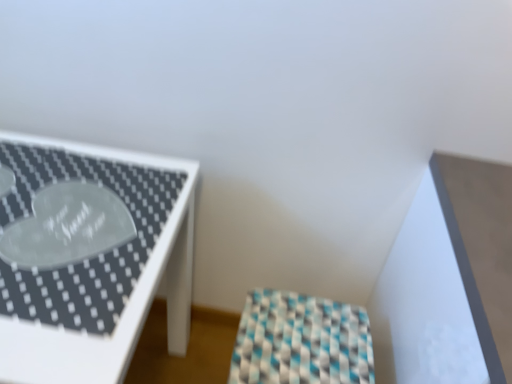
In order to click on checkered fabric stool at center, which appears as the second furniture when viewed from the left in this screenshot , I will do `click(301, 341)`.

What do you see at coordinates (301, 341) in the screenshot? The image size is (512, 384). I see `checkered fabric stool at center, which appears as the second furniture when viewed from the left` at bounding box center [301, 341].

How much space does white glossy table at left, positioned as the 1th furniture in left-to-right order, occupy vertically?

The height of white glossy table at left, positioned as the 1th furniture in left-to-right order, is 30.68 inches.

Describe the element at coordinates (95, 265) in the screenshot. I see `white glossy table at left, which appears as the 2th furniture when viewed from the right` at that location.

The height and width of the screenshot is (384, 512). Find the location of `white glossy table at left, which appears as the 2th furniture when viewed from the right`. white glossy table at left, which appears as the 2th furniture when viewed from the right is located at coordinates (95, 265).

The height and width of the screenshot is (384, 512). Find the location of `checkered fabric stool at center, which appears as the second furniture when viewed from the left`. checkered fabric stool at center, which appears as the second furniture when viewed from the left is located at coordinates (301, 341).

Which object is positioned more to the left, white glossy table at left, which appears as the 2th furniture when viewed from the right, or checkered fabric stool at center, which appears as the second furniture when viewed from the left?

white glossy table at left, which appears as the 2th furniture when viewed from the right.

Looking at this image, which object is further away from the camera taking this photo, white glossy table at left, which appears as the 2th furniture when viewed from the right, or checkered fabric stool at center, which is the 1th furniture in right-to-left order?

checkered fabric stool at center, which is the 1th furniture in right-to-left order, is more distant.

Which is farther, [16,194] or [311,358]?

The point [311,358] is behind.

From the image's perspective, which is above, white glossy table at left, positioned as the 1th furniture in left-to-right order, or checkered fabric stool at center, which appears as the second furniture when viewed from the left?

white glossy table at left, positioned as the 1th furniture in left-to-right order, appears higher in the image.

From a real-world perspective, is white glossy table at left, which appears as the 2th furniture when viewed from the right, over checkered fabric stool at center, which appears as the second furniture when viewed from the left?

Yes, from a real-world perspective, white glossy table at left, which appears as the 2th furniture when viewed from the right, is over checkered fabric stool at center, which appears as the second furniture when viewed from the left

In the scene shown: Considering the relative sizes of white glossy table at left, which appears as the 2th furniture when viewed from the right, and checkered fabric stool at center, which appears as the second furniture when viewed from the left, in the image provided, is white glossy table at left, which appears as the 2th furniture when viewed from the right, thinner than checkered fabric stool at center, which appears as the second furniture when viewed from the left,?

No.

Does white glossy table at left, positioned as the 1th furniture in left-to-right order, have a greater height compared to checkered fabric stool at center, which appears as the second furniture when viewed from the left?

Yes.

Looking at the image, does white glossy table at left, which appears as the 2th furniture when viewed from the right, seem bigger or smaller compared to checkered fabric stool at center, which appears as the second furniture when viewed from the left?

In the image, white glossy table at left, which appears as the 2th furniture when viewed from the right, appears to be larger than checkered fabric stool at center, which appears as the second furniture when viewed from the left.

Is white glossy table at left, which appears as the 2th furniture when viewed from the right, inside the boundaries of checkered fabric stool at center, which appears as the second furniture when viewed from the left, or outside?

white glossy table at left, which appears as the 2th furniture when viewed from the right, exists outside the volume of checkered fabric stool at center, which appears as the second furniture when viewed from the left.

Are white glossy table at left, which appears as the 2th furniture when viewed from the right, and checkered fabric stool at center, which appears as the second furniture when viewed from the left, located far from each other?

white glossy table at left, which appears as the 2th furniture when viewed from the right, is near checkered fabric stool at center, which appears as the second furniture when viewed from the left, not far away.

Is white glossy table at left, positioned as the 1th furniture in left-to-right order, facing towards checkered fabric stool at center, which is the 1th furniture in right-to-left order?

No, white glossy table at left, positioned as the 1th furniture in left-to-right order, is not aimed at checkered fabric stool at center, which is the 1th furniture in right-to-left order.

At what (x,y) coordinates should I click in order to perform the action: click on furniture above the checkered fabric stool at center, which appears as the second furniture when viewed from the left (from the image's perspective). Please return your answer as a coordinate pair (x, y). The image size is (512, 384). Looking at the image, I should click on (95, 265).

Which object is positioned more to the left, checkered fabric stool at center, which is the 1th furniture in right-to-left order, or white glossy table at left, positioned as the 1th furniture in left-to-right order?

white glossy table at left, positioned as the 1th furniture in left-to-right order.

Between checkered fabric stool at center, which is the 1th furniture in right-to-left order, and white glossy table at left, which appears as the 2th furniture when viewed from the right, which one is positioned in front?

white glossy table at left, which appears as the 2th furniture when viewed from the right.

Which is less distant, (367, 359) or (7, 305)?

Clearly, point (367, 359) is more distant from the camera than point (7, 305).

From the image's perspective, is checkered fabric stool at center, which is the 1th furniture in right-to-left order, on top of white glossy table at left, positioned as the 1th furniture in left-to-right order?

Actually, checkered fabric stool at center, which is the 1th furniture in right-to-left order, appears below white glossy table at left, positioned as the 1th furniture in left-to-right order, in the image.

From a real-world perspective, is checkered fabric stool at center, which is the 1th furniture in right-to-left order, positioned above or below white glossy table at left, which appears as the 2th furniture when viewed from the right?

checkered fabric stool at center, which is the 1th furniture in right-to-left order, is below white glossy table at left, which appears as the 2th furniture when viewed from the right.

Considering the sizes of checkered fabric stool at center, which appears as the second furniture when viewed from the left, and white glossy table at left, which appears as the 2th furniture when viewed from the right, in the image, is checkered fabric stool at center, which appears as the second furniture when viewed from the left, wider or thinner than white glossy table at left, which appears as the 2th furniture when viewed from the right,?

Clearly, checkered fabric stool at center, which appears as the second furniture when viewed from the left, has less width compared to white glossy table at left, which appears as the 2th furniture when viewed from the right.

From their relative heights in the image, would you say checkered fabric stool at center, which is the 1th furniture in right-to-left order, is taller or shorter than white glossy table at left, positioned as the 1th furniture in left-to-right order?

In the image, checkered fabric stool at center, which is the 1th furniture in right-to-left order, appears to be shorter than white glossy table at left, positioned as the 1th furniture in left-to-right order.

Does checkered fabric stool at center, which appears as the second furniture when viewed from the left, have a larger size compared to white glossy table at left, positioned as the 1th furniture in left-to-right order?

Incorrect, checkered fabric stool at center, which appears as the second furniture when viewed from the left, is not larger than white glossy table at left, positioned as the 1th furniture in left-to-right order.

Is checkered fabric stool at center, which is the 1th furniture in right-to-left order, inside the boundaries of white glossy table at left, which appears as the 2th furniture when viewed from the right, or outside?

checkered fabric stool at center, which is the 1th furniture in right-to-left order, is spatially situated outside white glossy table at left, which appears as the 2th furniture when viewed from the right.

Is checkered fabric stool at center, which appears as the second furniture when viewed from the left, directly adjacent to white glossy table at left, which appears as the 2th furniture when viewed from the right?

No, checkered fabric stool at center, which appears as the second furniture when viewed from the left, is not making contact with white glossy table at left, which appears as the 2th furniture when viewed from the right.

Is checkered fabric stool at center, which is the 1th furniture in right-to-left order, oriented towards white glossy table at left, which appears as the 2th furniture when viewed from the right?

Yes, checkered fabric stool at center, which is the 1th furniture in right-to-left order, is facing white glossy table at left, which appears as the 2th furniture when viewed from the right.

Can you tell me how much checkered fabric stool at center, which appears as the second furniture when viewed from the left, and white glossy table at left, positioned as the 1th furniture in left-to-right order, differ in facing direction?

93.1 degrees.

You are a GUI agent. You are given a task and a screenshot of the screen. Output one action in this format:
    pyautogui.click(x=<x>, y=<y>)
    Task: Click on the furniture lying above the checkered fabric stool at center, which appears as the second furniture when viewed from the left (from the image's perspective)
    Image resolution: width=512 pixels, height=384 pixels.
    Given the screenshot: What is the action you would take?
    pyautogui.click(x=95, y=265)

This screenshot has height=384, width=512. Find the location of `furniture that is below the white glossy table at left, positioned as the 1th furniture in left-to-right order (from the image's perspective)`. furniture that is below the white glossy table at left, positioned as the 1th furniture in left-to-right order (from the image's perspective) is located at coordinates (301, 341).

This screenshot has height=384, width=512. Find the location of `furniture that is in front of the checkered fabric stool at center, which appears as the second furniture when viewed from the left`. furniture that is in front of the checkered fabric stool at center, which appears as the second furniture when viewed from the left is located at coordinates (95, 265).